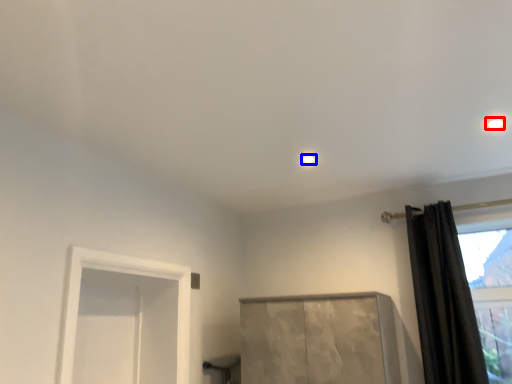
Question: Which object is closer to the camera taking this photo, lighting (highlighted by a red box) or lighting (highlighted by a blue box)?

Choices:
 (A) lighting
 (B) lighting

Answer: (A)